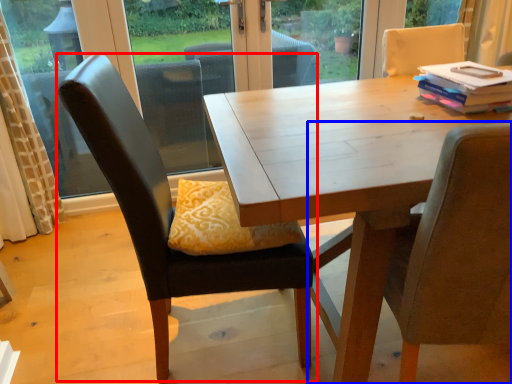
Question: Among these objects, which one is farthest to the camera, chair (highlighted by a red box) or chair (highlighted by a blue box)?

Choices:
 (A) chair
 (B) chair

Answer: (A)